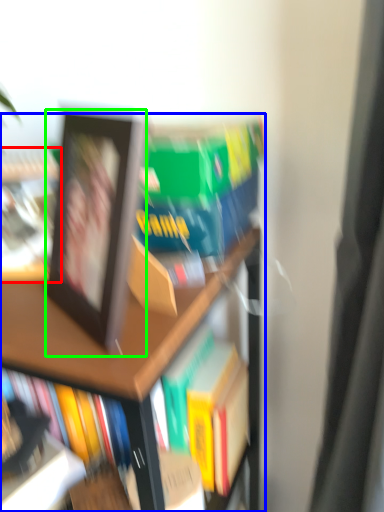
Question: Which object is the farthest from book (highlighted by a red box)? Choose among these: bookcase (highlighted by a blue box) or picture frame (highlighted by a green box).

Choices:
 (A) bookcase
 (B) picture frame

Answer: (A)